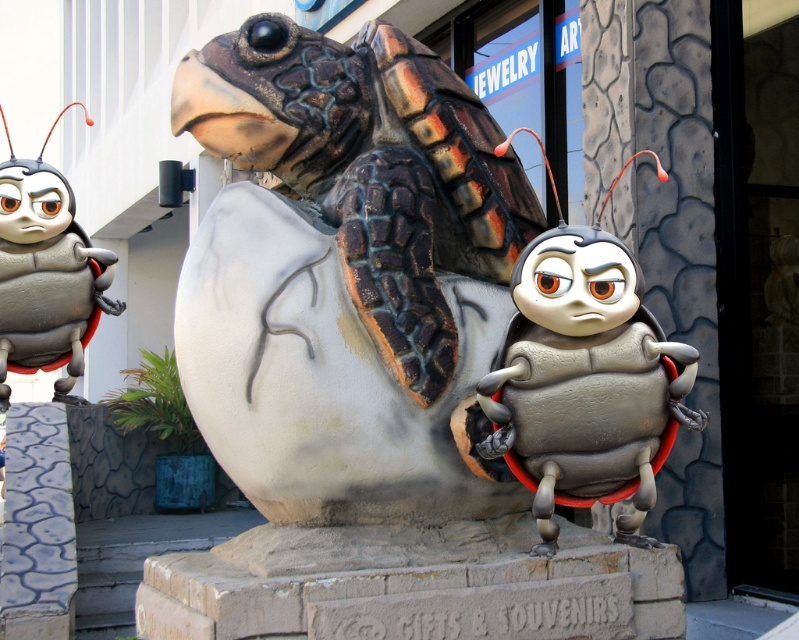
What do you see at coordinates (370, 168) in the screenshot? I see `matte painted tortoise at center` at bounding box center [370, 168].

Can you confirm if matte painted tortoise at center is positioned below metallic gray beetle at center?

Incorrect, matte painted tortoise at center is not positioned below metallic gray beetle at center.

Is point (515, 195) behind point (678, 348)?

Yes, point (515, 195) is behind point (678, 348).

At what (x,y) coordinates should I click in order to perform the action: click on matte painted tortoise at center. Please return your answer as a coordinate pair (x, y). This screenshot has height=640, width=799. Looking at the image, I should click on (370, 168).

Between matte painted tortoise at center and brushed metal bug at left, which one has more height?

Standing taller between the two is matte painted tortoise at center.

At what (x,y) coordinates should I click in order to perform the action: click on matte painted tortoise at center. Please return your answer as a coordinate pair (x, y). Looking at the image, I should click on (370, 168).

Where is `matte painted tortoise at center`? Image resolution: width=799 pixels, height=640 pixels. matte painted tortoise at center is located at coordinates (370, 168).

Which is above, metallic gray beetle at center or brushed metal bug at left?

brushed metal bug at left is above.

Measure the distance between point (563, 435) and camera.

A distance of 5.08 meters exists between point (563, 435) and camera.

The image size is (799, 640). I want to click on metallic gray beetle at center, so click(x=585, y=381).